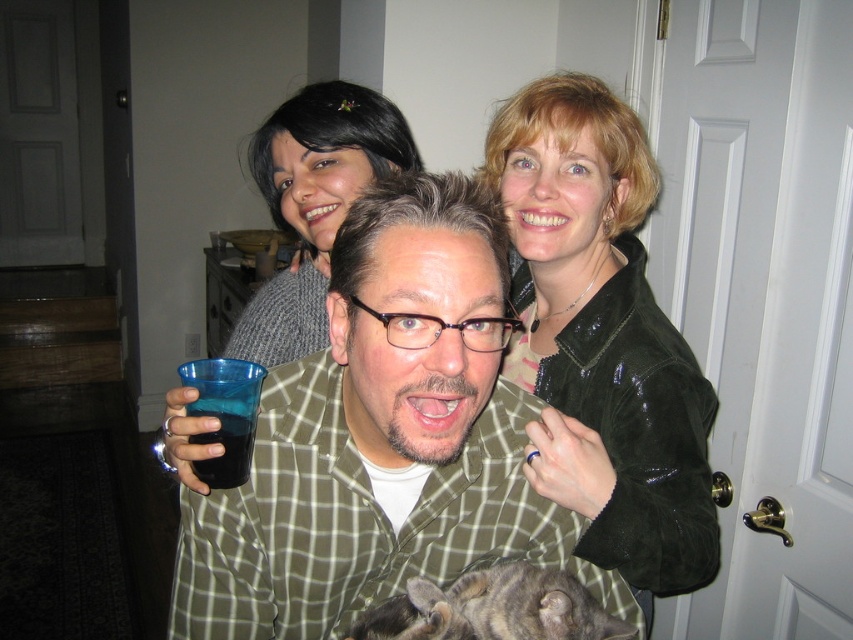
In the image, there is a man wearing a green plaid shirt at center and a gray tabby cat at bottom right corner. The man is holding a blue plastic cup. If you were standing at the point marked by the coordinates point [383,438], which object would you be closest to?

The point [383,438] indicates the green plaid shirt at center, so you would be closest to the man wearing the green plaid shirt at center.

You are standing at the entrance of the hallway and want to reach the point marked as point (241,333). Which direction should you move relative to point (461,612) to get there?

You should move behind point (461,612) to reach point (241,333) because point (241,333) is located behind point (461,612).

You are organizing a charity event and need to place a 15 cm wide donation box on the table. The gray sweater at upper center and the tabby fur cat at lower center are already on the table. Can the donation box fit between them?

The gray sweater at upper center is wider than the tabby fur cat at lower center. Since the sweater is wider, there might not be enough space between them for the 15 cm donation box. Check the actual distance between them to be sure.